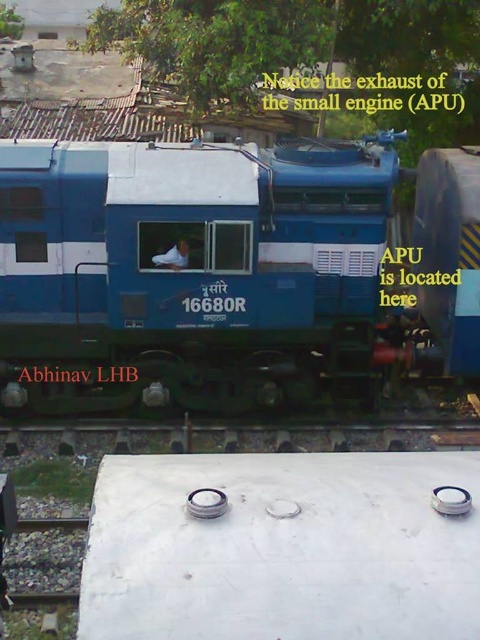
Question: Can you confirm if blue matte train at center is positioned above gray concrete train track at bottom?

Choices:
 (A) yes
 (B) no

Answer: (A)

Question: Is blue matte train at center wider than gray concrete train track at bottom?

Choices:
 (A) no
 (B) yes

Answer: (A)

Question: Can you confirm if blue matte train at center is positioned below gray concrete train track at bottom?

Choices:
 (A) yes
 (B) no

Answer: (B)

Question: Among these objects, which one is nearest to the camera?

Choices:
 (A) blue matte train at center
 (B) gray concrete train track at bottom

Answer: (B)